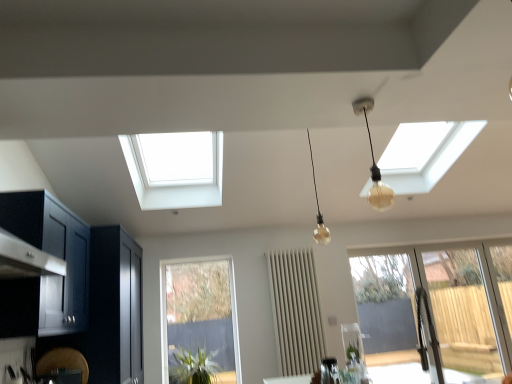
Question: Is matte glass bulb at upper center, which appears as the 2th lamp when viewed from the back, taller than clear glass window at lower center, the 1th window positioned from the left?

Choices:
 (A) no
 (B) yes

Answer: (A)

Question: Is clear glass window at lower center, the 1th window positioned from the left, a part of matte glass bulb at upper center, the 1th lamp positioned from the front?

Choices:
 (A) yes
 (B) no

Answer: (B)

Question: Does matte glass bulb at upper center, which appears as the 2th lamp when viewed from the back, have a greater width compared to clear glass window at lower center, the 1th window positioned from the left?

Choices:
 (A) no
 (B) yes

Answer: (B)

Question: From a real-world perspective, is matte glass bulb at upper center, the 1th lamp positioned from the front, located higher than clear glass window at lower center, the 1th window positioned from the left?

Choices:
 (A) yes
 (B) no

Answer: (A)

Question: Is matte glass bulb at upper center, which appears as the 2th lamp when viewed from the back, oriented towards clear glass window at lower center, which is the 2th window from right to left?

Choices:
 (A) no
 (B) yes

Answer: (A)

Question: Is matte glass bulb at upper center, which appears as the 2th lamp when viewed from the back, further to the viewer compared to clear glass window at lower center, the 1th window positioned from the left?

Choices:
 (A) no
 (B) yes

Answer: (A)

Question: Is the position of matte glass bulb at upper center, which appears as the 2th lamp when viewed from the back, less distant than that of matte glass bulb at center, acting as the 1th lamp starting from the back?

Choices:
 (A) no
 (B) yes

Answer: (B)

Question: Is matte glass bulb at upper center, which appears as the 2th lamp when viewed from the back, turned away from matte glass bulb at center, acting as the 1th lamp starting from the back?

Choices:
 (A) yes
 (B) no

Answer: (B)

Question: From a real-world perspective, is matte glass bulb at upper center, the 1th lamp positioned from the front, physically below matte glass bulb at center, acting as the 1th lamp starting from the back?

Choices:
 (A) yes
 (B) no

Answer: (A)

Question: Considering the relative sizes of matte glass bulb at upper center, which appears as the 2th lamp when viewed from the back, and matte glass bulb at center, acting as the 1th lamp starting from the back, in the image provided, is matte glass bulb at upper center, which appears as the 2th lamp when viewed from the back, shorter than matte glass bulb at center, acting as the 1th lamp starting from the back,?

Choices:
 (A) no
 (B) yes

Answer: (B)

Question: From the image's perspective, would you say matte glass bulb at upper center, the 1th lamp positioned from the front, is shown under matte glass bulb at center, which appears as the second lamp when viewed from the front?

Choices:
 (A) no
 (B) yes

Answer: (A)

Question: Considering the relative sizes of matte glass bulb at upper center, the 1th lamp positioned from the front, and matte glass bulb at center, acting as the 1th lamp starting from the back, in the image provided, is matte glass bulb at upper center, the 1th lamp positioned from the front, bigger than matte glass bulb at center, acting as the 1th lamp starting from the back,?

Choices:
 (A) yes
 (B) no

Answer: (B)

Question: Can you confirm if metallic silver kettle at center is smaller than matte glass bulb at center, which appears as the second lamp when viewed from the front?

Choices:
 (A) no
 (B) yes

Answer: (B)